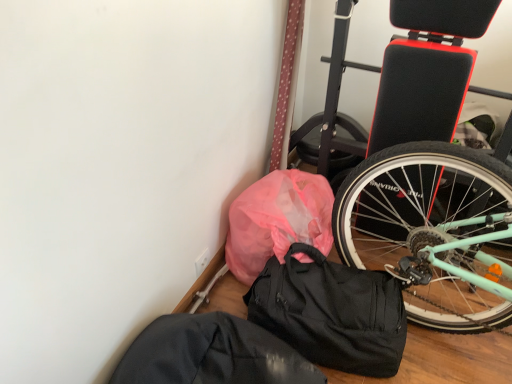
Question: From the image's perspective, is pink plastic bag at lower left over black fabric sack at lower center?

Choices:
 (A) no
 (B) yes

Answer: (B)

Question: Is pink plastic bag at lower left to the right of black fabric sack at lower center from the viewer's perspective?

Choices:
 (A) yes
 (B) no

Answer: (A)

Question: Is pink plastic bag at lower left smaller than black fabric sack at lower center?

Choices:
 (A) yes
 (B) no

Answer: (B)

Question: From a real-world perspective, is pink plastic bag at lower left beneath black fabric sack at lower center?

Choices:
 (A) yes
 (B) no

Answer: (B)

Question: Is pink plastic bag at lower left in contact with black fabric sack at lower center?

Choices:
 (A) yes
 (B) no

Answer: (B)

Question: Is black matte duffel bag at lower center bigger or smaller than pink plastic bag at lower left?

Choices:
 (A) small
 (B) big

Answer: (A)

Question: Considering the relative positions of black matte duffel bag at lower center and pink plastic bag at lower left in the image provided, is black matte duffel bag at lower center to the left or to the right of pink plastic bag at lower left?

Choices:
 (A) left
 (B) right

Answer: (B)

Question: From a real-world perspective, is black matte duffel bag at lower center physically located above or below pink plastic bag at lower left?

Choices:
 (A) above
 (B) below

Answer: (B)

Question: Do you think black matte duffel bag at lower center is within pink plastic bag at lower left, or outside of it?

Choices:
 (A) inside
 (B) outside

Answer: (B)

Question: From their relative heights in the image, would you say pink plastic bag at lower left is taller or shorter than black matte duffel bag at lower center?

Choices:
 (A) short
 (B) tall

Answer: (B)

Question: Based on their sizes in the image, would you say pink plastic bag at lower left is bigger or smaller than black matte duffel bag at lower center?

Choices:
 (A) big
 (B) small

Answer: (A)

Question: In terms of width, does pink plastic bag at lower left look wider or thinner when compared to black matte duffel bag at lower center?

Choices:
 (A) wide
 (B) thin

Answer: (B)

Question: Is point (281, 218) closer or farther from the camera than point (285, 329)?

Choices:
 (A) farther
 (B) closer

Answer: (A)

Question: Visually, is pink plastic bag at lower left positioned to the left or to the right of black fabric sack at lower center?

Choices:
 (A) right
 (B) left

Answer: (A)

Question: Does point (292, 225) appear closer or farther from the camera than point (156, 339)?

Choices:
 (A) closer
 (B) farther

Answer: (B)